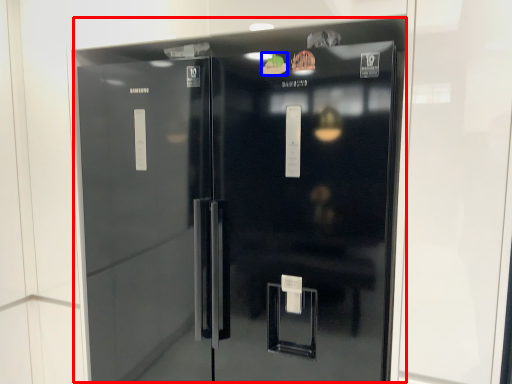
Question: Which point is further to the camera, refrigerator (highlighted by a red box) or food (highlighted by a blue box)?

Choices:
 (A) refrigerator
 (B) food

Answer: (B)